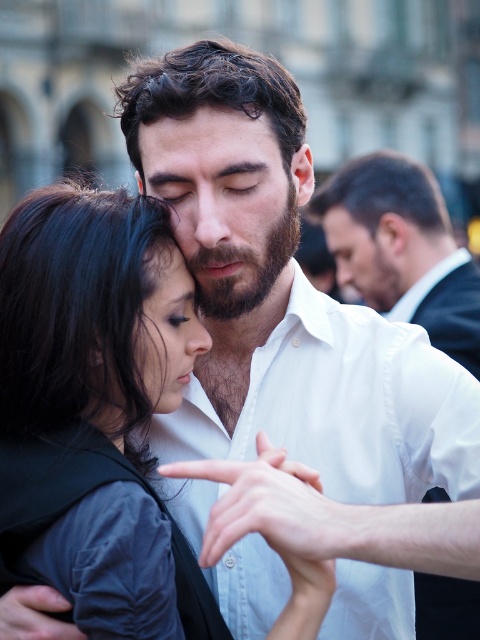
Who is more forward, (355, 218) or (172, 170)?

Point (172, 170) is in front.

This screenshot has width=480, height=640. Find the location of `white smooth shirt at center`. white smooth shirt at center is located at coordinates (402, 250).

Which is below, white shirt at upper right or dark brown hair at center?

dark brown hair at center

Is white shirt at upper right thinner than dark brown hair at center?

No, white shirt at upper right is not thinner than dark brown hair at center.

The image size is (480, 640). In order to click on white shirt at upper right in this screenshot , I will do `click(402, 250)`.

The image size is (480, 640). What are the coordinates of `white shirt at upper right` in the screenshot? It's located at (402, 250).

Between smooth black hair at center and dark brown hair at center, which one has more height?

With more height is smooth black hair at center.

The height and width of the screenshot is (640, 480). I want to click on smooth black hair at center, so click(x=91, y=388).

Find the location of `smooth black hair at center`. smooth black hair at center is located at coordinates (91, 388).